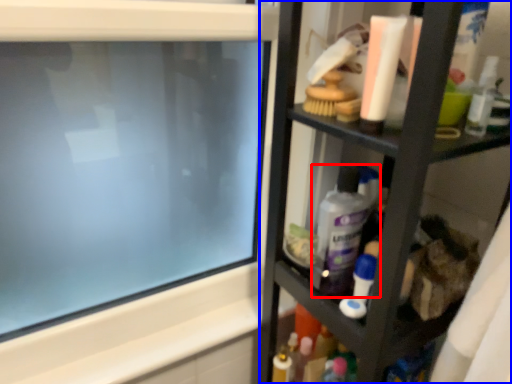
Question: Which point is further to the camera, cleaning product (highlighted by a red box) or shelf (highlighted by a blue box)?

Choices:
 (A) cleaning product
 (B) shelf

Answer: (A)